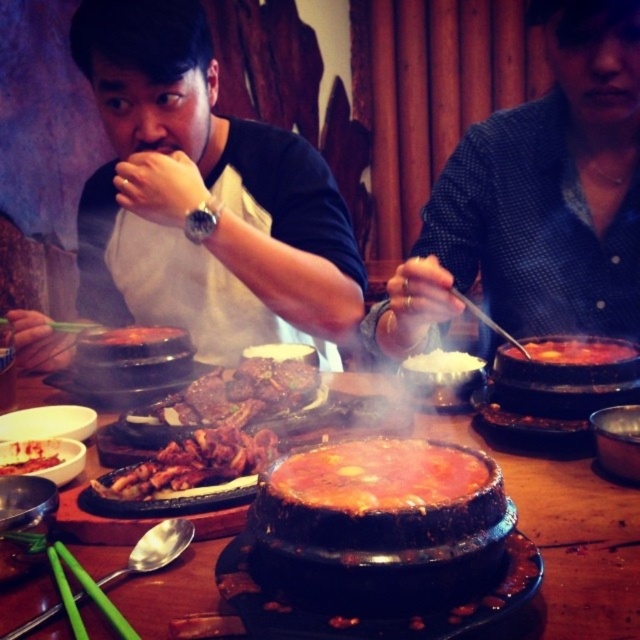
You are a diner at the table. Your grilled meat at center is to the right of your green plastic chopsticks at lower left. Which object is closer to the edge of the table?

The green plastic chopsticks at lower left are closer to the edge of the table because they are positioned at the lower left corner, which is typically near the edge, while the grilled meat at center is centrally placed, further from the edge.

You are a food delivery person who needs to pick up the black stone pot at center from the table. The delivery guidelines state that you must maintain a minimum distance of 20 inches from the table to avoid spills. Can you safely pick up the pot without violating the guidelines?

The black stone pot at center is 19.38 inches away from the viewer, which is less than the required 20 inches. Therefore, picking it up would violate the delivery guidelines.

You are a server at the Korean restaurant. You need to place a new dish on the table, but you must ensure it doesn not block the view of the black stone pot at center from the diners seated around the table. Where should you place the new dish in relation to the brown glossy meat at center?

The black stone pot at center is above the brown glossy meat at center, so placing the new dish below the brown glossy meat at center would keep it out of the diners line of sight to the black stone pot at center.